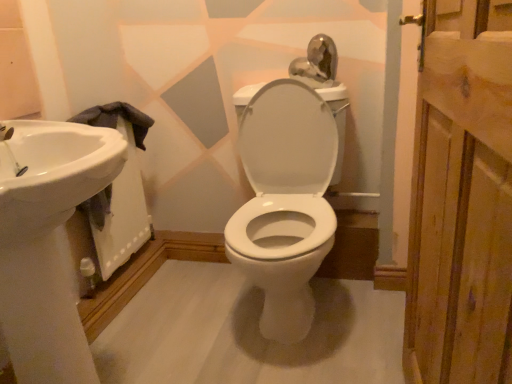
What are the coordinates of `empty space that is ontop of white glossy sink at left (from a real-world perspective)` in the screenshot? It's located at (93, 114).